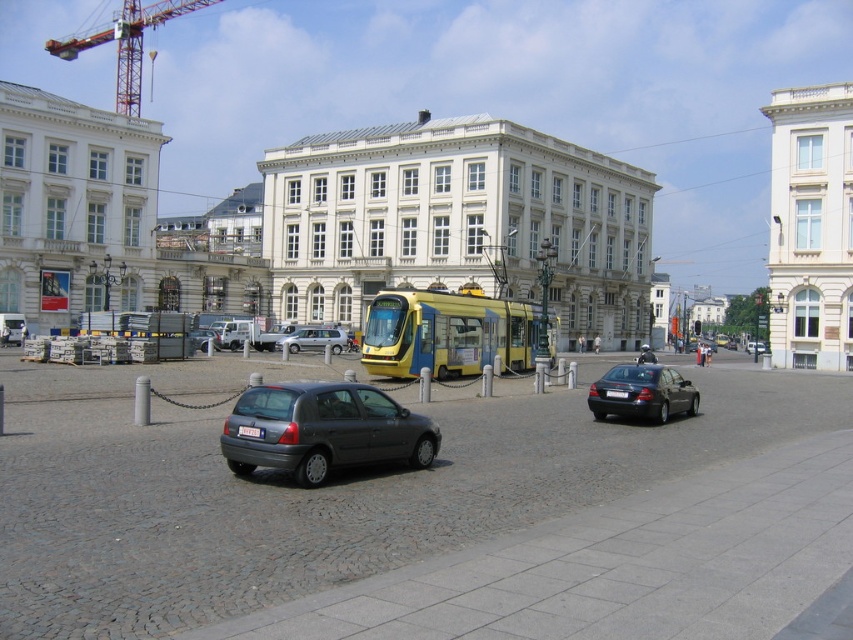
Is matte gray hatchback at center-left thinner than matte gray hatchback at center?

Yes, matte gray hatchback at center-left is thinner than matte gray hatchback at center.

Locate an element on the screen. The width and height of the screenshot is (853, 640). matte gray hatchback at center-left is located at coordinates (322, 429).

Does shiny black sedan at center lie in front of matte gray hatchback at center?

Yes, shiny black sedan at center is closer to the viewer.

Looking at this image, does shiny black sedan at center appear on the left side of matte gray hatchback at center?

In fact, shiny black sedan at center is to the right of matte gray hatchback at center.

Is point (633, 385) farther from camera compared to point (194, 344)?

No, (633, 385) is closer to viewer.

This screenshot has height=640, width=853. In order to click on shiny black sedan at center in this screenshot , I will do `click(642, 392)`.

Consider the image. Is orange metallic crane at upper left thinner than silver metallic hatchback at center?

Incorrect, orange metallic crane at upper left's width is not less than silver metallic hatchback at center's.

Does point (119, 93) lie behind point (285, 342)?

Yes, point (119, 93) is behind point (285, 342).

Image resolution: width=853 pixels, height=640 pixels. In order to click on orange metallic crane at upper left in this screenshot , I will do `click(126, 44)`.